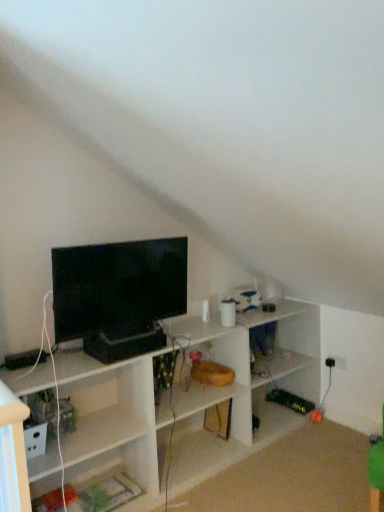
Locate an element on the screen. The height and width of the screenshot is (512, 384). matte black tv at upper left is located at coordinates (118, 287).

What do you see at coordinates (118, 287) in the screenshot? I see `matte black tv at upper left` at bounding box center [118, 287].

Locate an element on the screen. The width and height of the screenshot is (384, 512). matte black tv at upper left is located at coordinates (118, 287).